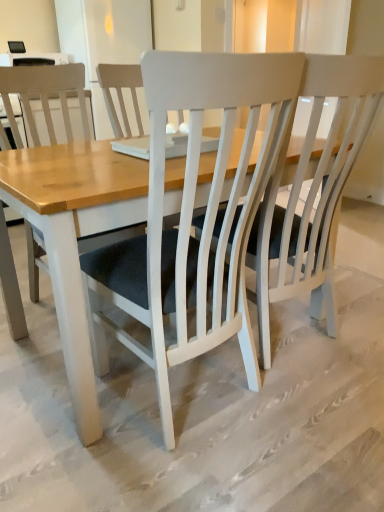
This screenshot has width=384, height=512. What are the coordinates of `unoccupied area in front of white matte chair at left` in the screenshot? It's located at (53, 369).